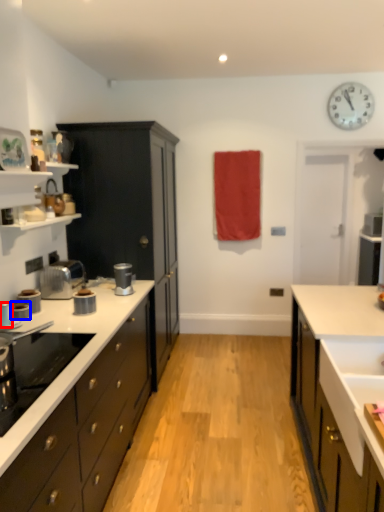
Question: Which object appears farthest to the camera in this image, kitchen appliance (highlighted by a red box) or kitchen appliance (highlighted by a blue box)?

Choices:
 (A) kitchen appliance
 (B) kitchen appliance

Answer: (B)